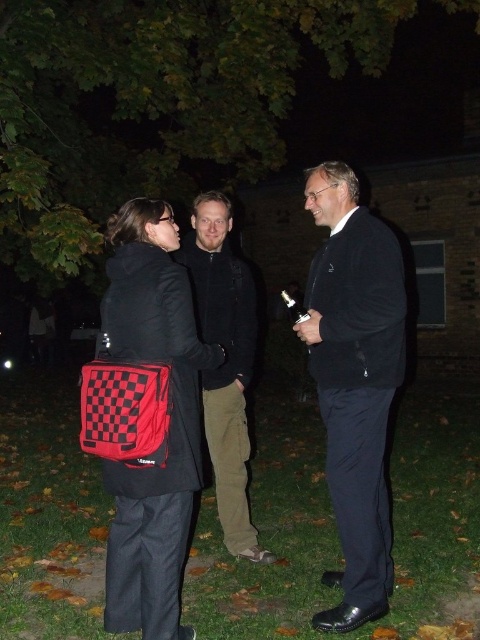
Question: Which point is closer to the camera?

Choices:
 (A) (367, 474)
 (B) (211, 390)

Answer: (A)

Question: Is matte black suit at center smaller than dark green cotton pants at center?

Choices:
 (A) no
 (B) yes

Answer: (B)

Question: Is matte black suit at center thinner than checkerboard fabric bag at left?

Choices:
 (A) no
 (B) yes

Answer: (A)

Question: Is checkerboard fabric bag at left bigger than dark green cotton pants at center?

Choices:
 (A) no
 (B) yes

Answer: (A)

Question: Which object is closer to the camera taking this photo?

Choices:
 (A) dark green cotton pants at center
 (B) checkerboard fabric bag at left

Answer: (B)

Question: Among these objects, which one is nearest to the camera?

Choices:
 (A) checkerboard fabric bag at left
 (B) matte black suit at center

Answer: (A)